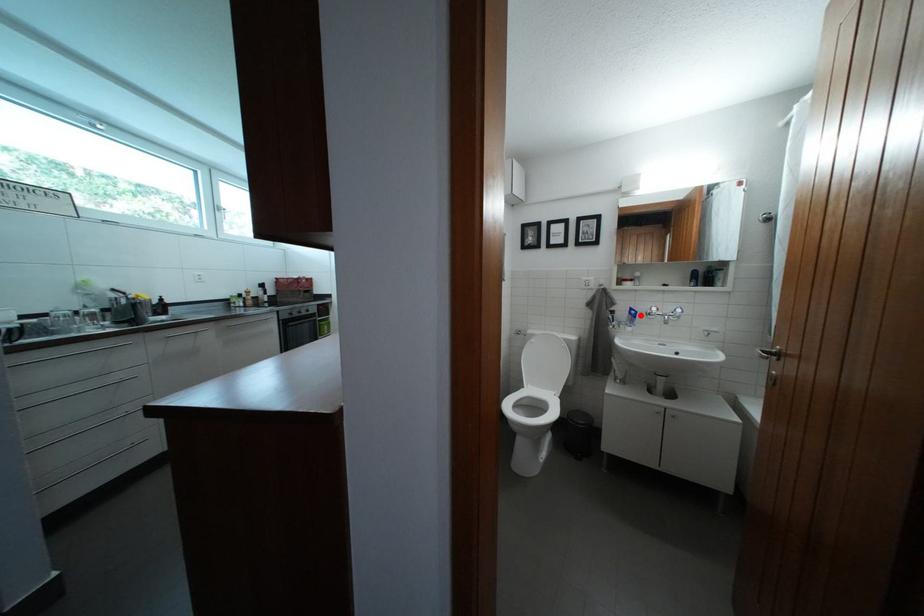
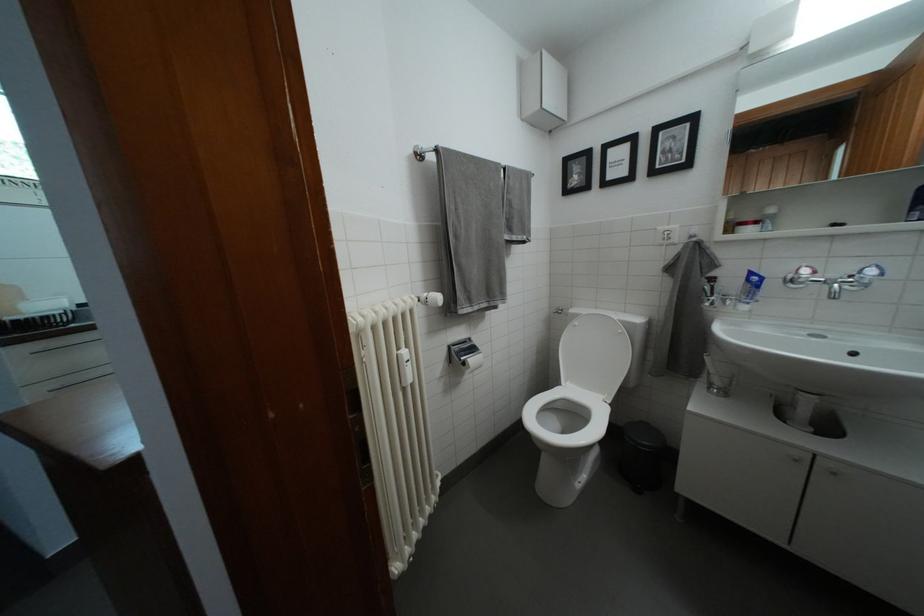
Locate, in the second image, the point that corresponds to the highlighted location in the first image.

(760, 280)